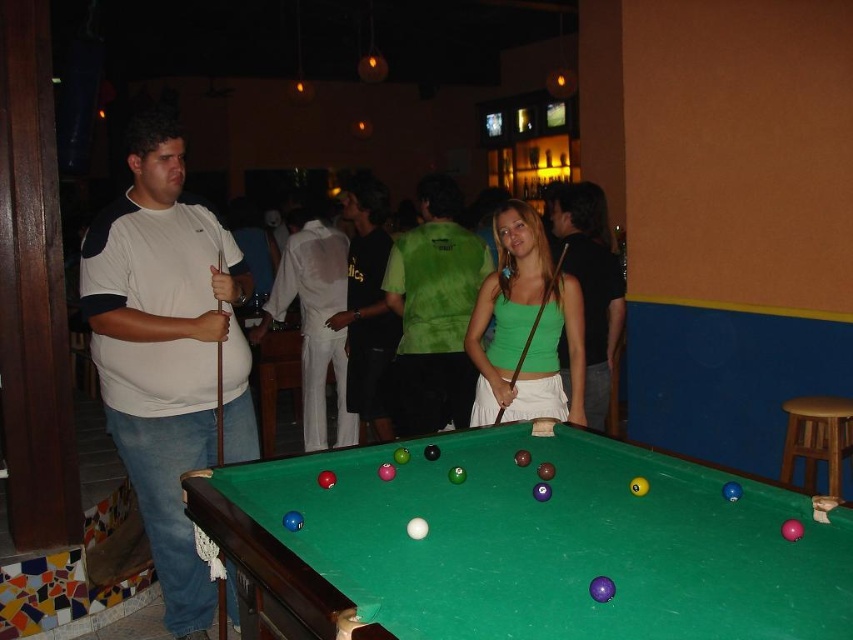
Question: Which of the following is the closest to the observer?

Choices:
 (A) (396, 292)
 (B) (442, 339)
 (C) (248, 531)
 (D) (589, 189)

Answer: (C)

Question: Is matte green tank top at center to the right of brown wooden stool at right from the viewer's perspective?

Choices:
 (A) yes
 (B) no

Answer: (B)

Question: Considering the real-world distances, which object is closest to the brown wooden stool at right?

Choices:
 (A) green fabric shirt at center
 (B) black smooth shirt at center

Answer: (B)

Question: Considering the real-world distances, which object is farthest from the white matte shirt at left?

Choices:
 (A) brown wooden stool at right
 (B) green matte tank top at center
 (C) white cotton shirt at center

Answer: (A)

Question: From the image, what is the correct spatial relationship of white matte shirt at left in relation to white cotton shirt at center?

Choices:
 (A) left
 (B) right

Answer: (A)

Question: Does white satin shirt at center appear over brown wooden stool at right?

Choices:
 (A) yes
 (B) no

Answer: (A)